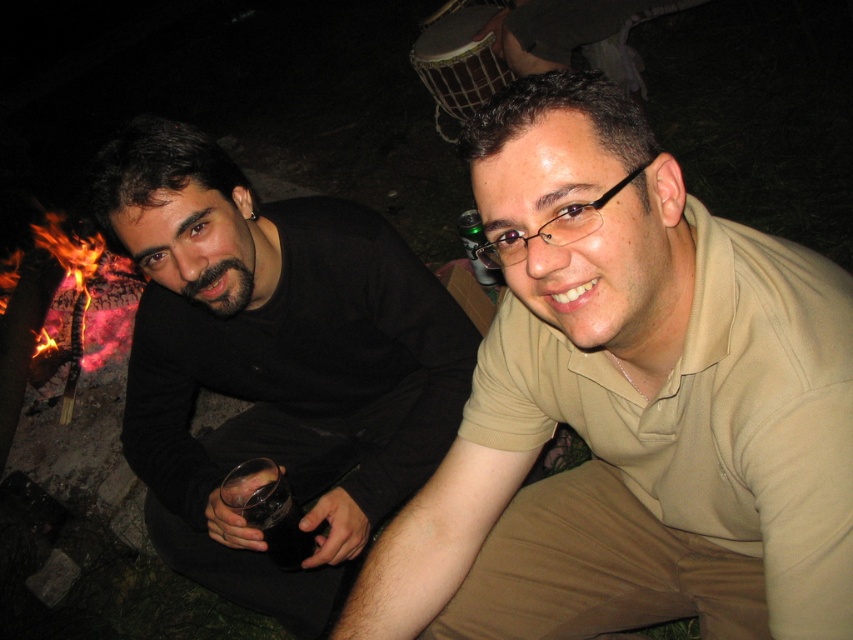
You are a photographer at the scene and want to capture both the black matte shirt at left and the translucent glass at center in a single photo. Since the camera can only focus on one object at a time, which object should you choose to ensure the larger object is in focus?

The black matte shirt at left is bigger than the translucent glass at center, so you should focus on the black matte shirt at left to ensure the larger object is in focus.

You are a photographer trying to capture a candid shot of the black matte shirt at left and the translucent glass at center. Since you want to ensure both subjects are in focus, you need to know their relative heights. Which object is taller?

The black matte shirt at left is much taller than the translucent glass at center, so you should adjust your camera settings to focus on the taller subject first.

From the picture: You are standing in front of the scene and want to determine which of the two points, point (x=548, y=406) or point (x=311, y=374), is closer to you. Based on the description, which point is nearer?

Point (x=548, y=406) is closer to the viewer than point (x=311, y=374).